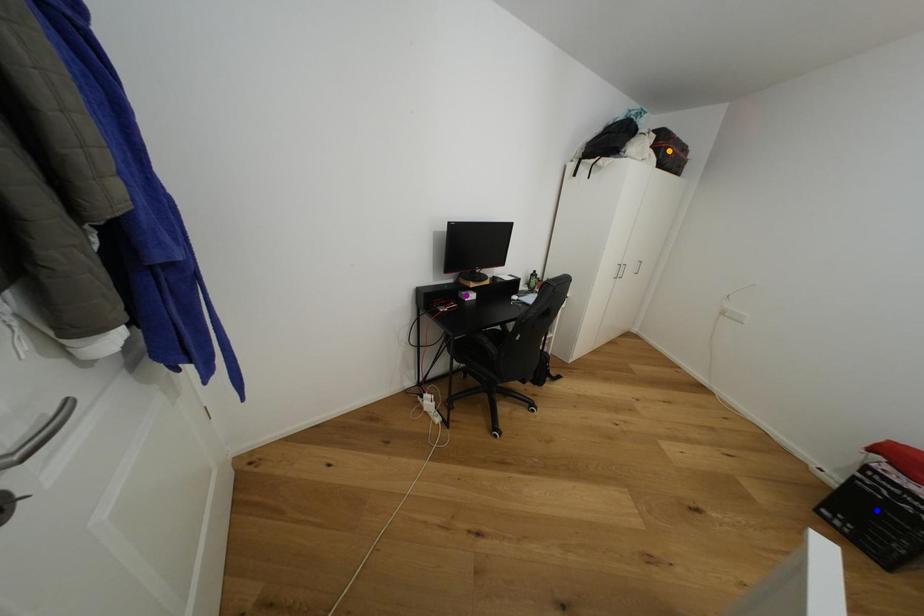
Order these from nearest to farthest:
- orange point
- purple point
- blue point

blue point
purple point
orange point